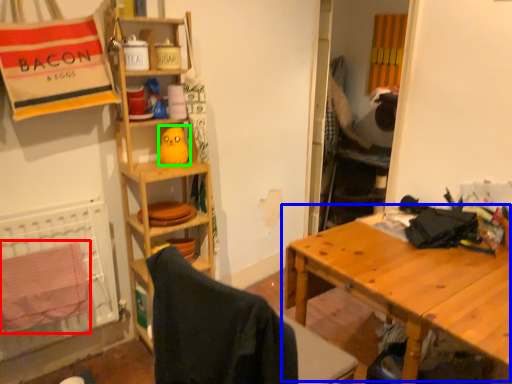
Question: Which object is positioned closest to beach towel (highlighted by a red box)? Select from table (highlighted by a blue box) and toy (highlighted by a green box).

Choices:
 (A) table
 (B) toy

Answer: (B)